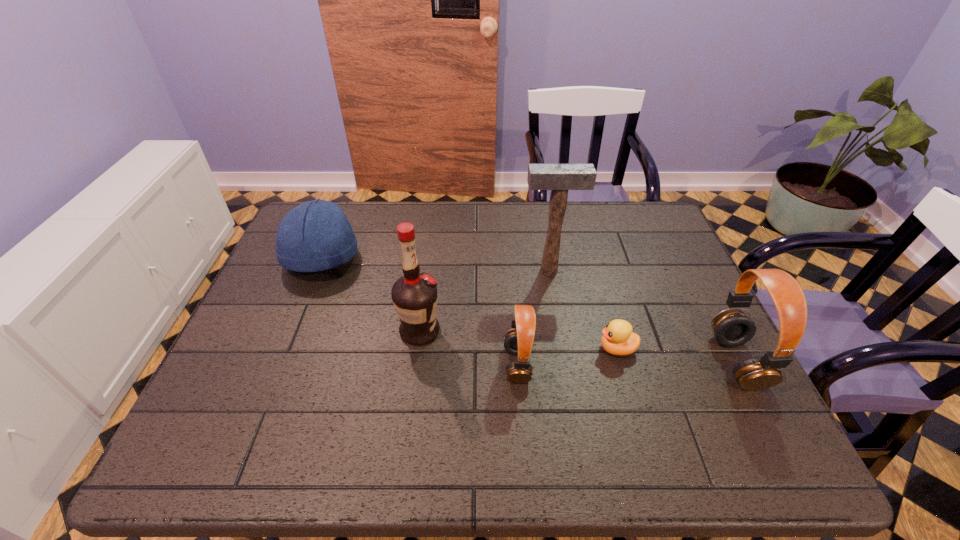
This screenshot has width=960, height=540. I want to click on free point that keeps the headsets evenly spaced on the left, so click(295, 367).